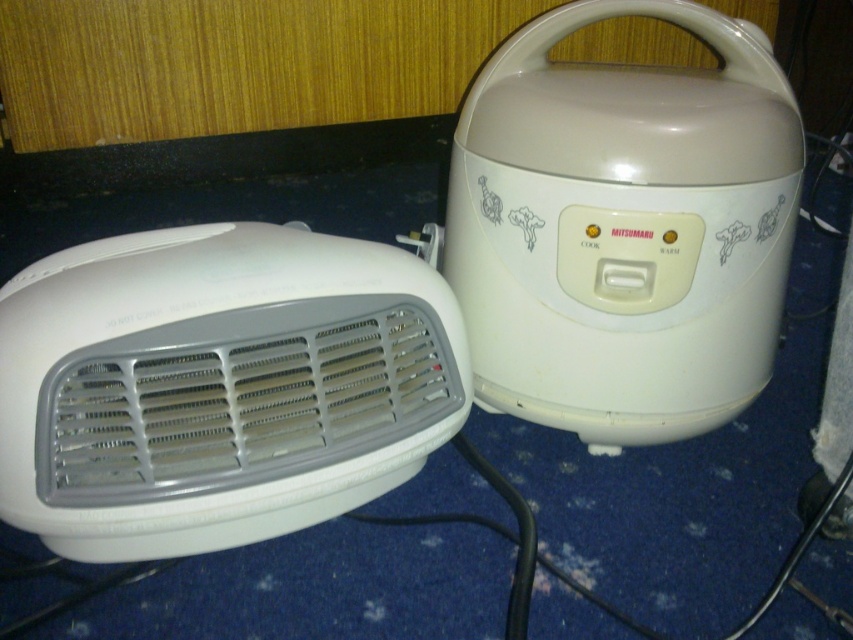
Looking at this image, you need to place a book that requires 15 cm of vertical space on the countertop between the white plastic heater at left and the white glossy rice cooker at right. Can the space between them accommodate the book vertically?

The white plastic heater at left is not as tall as the white glossy rice cooker at right, so the vertical space between them may vary. However, since the heater is shorter, the available vertical space might be sufficient. To ensure, measure the gap between their tops. If it is at least 15 cm, the book can fit.

You are standing in the kitchen and need to locate the point at coordinates (x=218, y=387) on the image. Which appliance should you look at?

The point at coordinates (x=218, y=387) is on the white plastic heater at left.